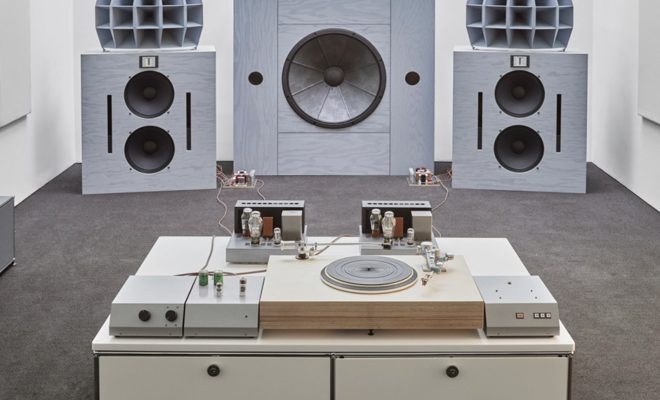
The height and width of the screenshot is (400, 660). I want to click on grey carpet, so click(x=601, y=272).